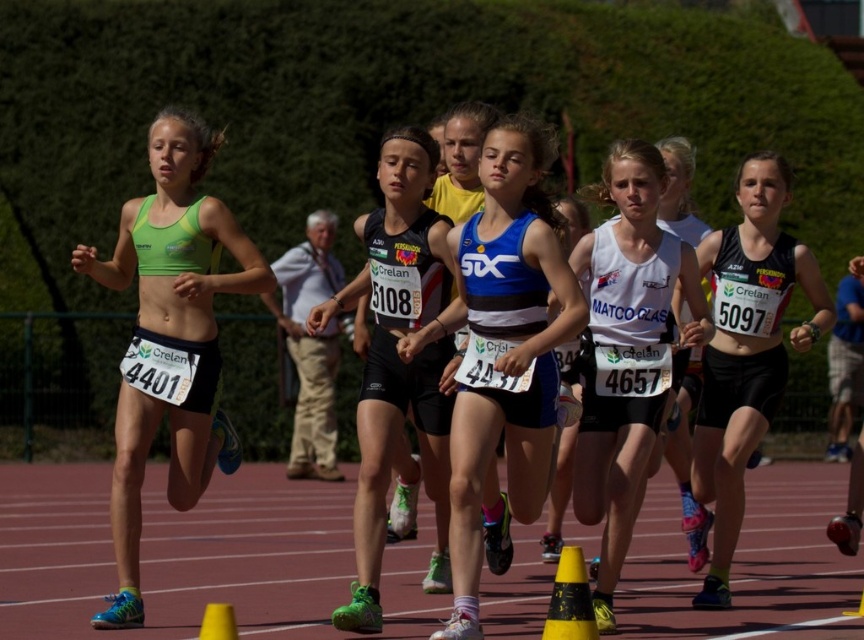
Looking at this image, you are a photographer positioned at the starting line of the track. You want to capture a photo that includes both the blue matte tank top at center and the green matte sports bra at left. Based on their positions, which athlete should you focus on first to ensure both are in frame?

The blue matte tank top at center is not as tall as the green matte sports bra at left. Therefore, you should focus on the green matte sports bra at left first since it is taller and will help frame both athletes properly.

In the image of the track and field event, there are two objects of interest. The first is a black matte tank top at center, and the second is a yellow plastic cone at lower right. From the perspective of an observer watching the race, which object is positioned to the right side?

The black matte tank top at center is positioned to the right of the yellow plastic cone at lower right.